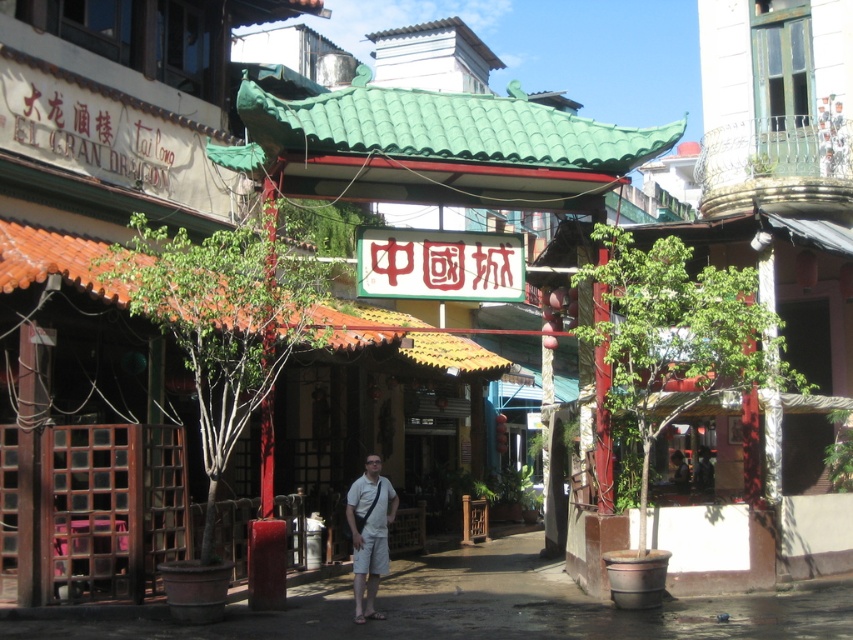
Does white cotton shorts at center have a smaller size compared to dark gray fabric pants at lower center?

Correct, white cotton shorts at center occupies less space than dark gray fabric pants at lower center.

Does white cotton shorts at center come in front of dark gray fabric pants at lower center?

Yes, white cotton shorts at center is in front of dark gray fabric pants at lower center.

Which is behind, point (386, 525) or point (679, 476)?

The point (679, 476) is more distant.

Locate an element on the screen. The height and width of the screenshot is (640, 853). white cotton shorts at center is located at coordinates (369, 532).

Measure the distance between green tile canopy at center and dark gray fabric pants at lower center.

green tile canopy at center is 12.26 meters away from dark gray fabric pants at lower center.

Which of these two, green tile canopy at center or dark gray fabric pants at lower center, stands shorter?

With less height is dark gray fabric pants at lower center.

Between point (469, 120) and point (679, 488), which one is positioned in front?

Point (469, 120) is more forward.

This screenshot has height=640, width=853. Find the location of `green tile canopy at center`. green tile canopy at center is located at coordinates (437, 147).

Can you confirm if green tile canopy at center is taller than white cotton shorts at center?

Yes, green tile canopy at center is taller than white cotton shorts at center.

Where is `green tile canopy at center`? green tile canopy at center is located at coordinates (x=437, y=147).

Find the location of a particular element. This screenshot has width=853, height=640. green tile canopy at center is located at coordinates (437, 147).